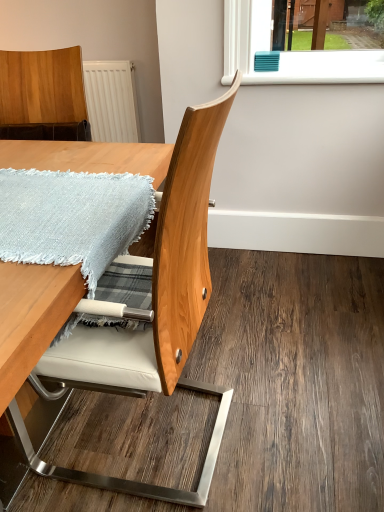
Question: Is wooden table at center to the left of wooden chair at center from the viewer's perspective?

Choices:
 (A) yes
 (B) no

Answer: (A)

Question: Is wooden table at center further to the viewer compared to wooden chair at center?

Choices:
 (A) no
 (B) yes

Answer: (A)

Question: Does wooden table at center have a greater height compared to wooden chair at center?

Choices:
 (A) yes
 (B) no

Answer: (B)

Question: Does wooden table at center turn towards wooden chair at center?

Choices:
 (A) yes
 (B) no

Answer: (B)

Question: From a real-world perspective, is wooden table at center beneath wooden chair at center?

Choices:
 (A) no
 (B) yes

Answer: (B)

Question: From the image's perspective, is light blue woven blanket at lower left positioned above or below wooden table at center?

Choices:
 (A) below
 (B) above

Answer: (B)

Question: Considering the positions of point (145, 199) and point (9, 280), is point (145, 199) closer or farther from the camera than point (9, 280)?

Choices:
 (A) farther
 (B) closer

Answer: (A)

Question: Is light blue woven blanket at lower left bigger or smaller than wooden table at center?

Choices:
 (A) small
 (B) big

Answer: (A)

Question: In the image, is light blue woven blanket at lower left on the left side or the right side of wooden table at center?

Choices:
 (A) right
 (B) left

Answer: (A)

Question: Looking at the image, does white plastic window sill at upper center seem bigger or smaller compared to wooden chair at center?

Choices:
 (A) small
 (B) big

Answer: (A)

Question: From a real-world perspective, is white plastic window sill at upper center above or below wooden chair at center?

Choices:
 (A) above
 (B) below

Answer: (A)

Question: In terms of width, does white plastic window sill at upper center look wider or thinner when compared to wooden chair at center?

Choices:
 (A) wide
 (B) thin

Answer: (B)

Question: Considering their positions, is white plastic window sill at upper center located in front of or behind wooden chair at center?

Choices:
 (A) front
 (B) behind

Answer: (B)

Question: Considering the relative positions of white plastic window sill at upper center and light blue woven blanket at lower left in the image provided, is white plastic window sill at upper center to the left or to the right of light blue woven blanket at lower left?

Choices:
 (A) left
 (B) right

Answer: (B)

Question: Is point (380, 76) positioned closer to the camera than point (26, 223)?

Choices:
 (A) closer
 (B) farther

Answer: (B)